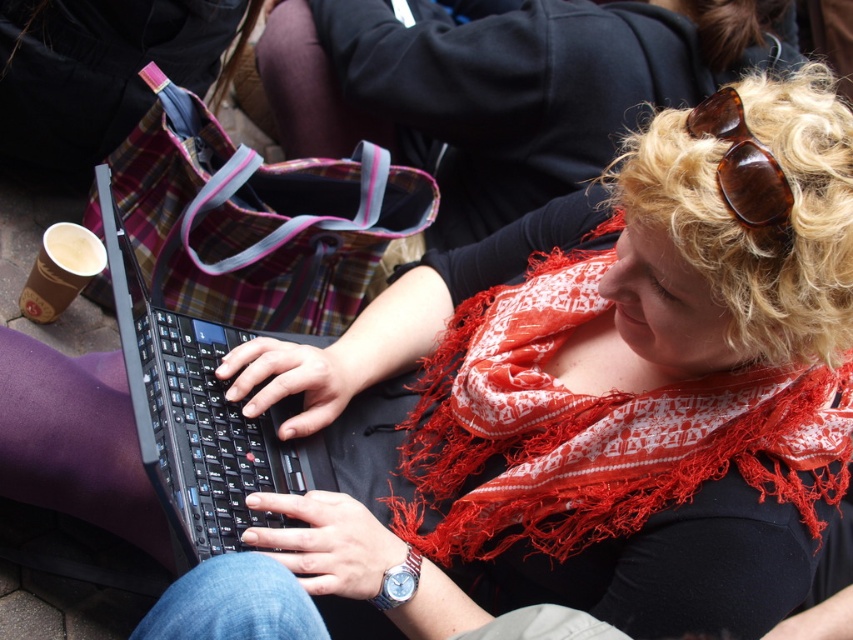
Question: Does red fringed scarf at center appear on the left side of tortoiseshell sunglasses at upper right?

Choices:
 (A) yes
 (B) no

Answer: (A)

Question: Among these points, which one is farthest from the camera?

Choices:
 (A) (706, 397)
 (B) (741, 164)

Answer: (A)

Question: Is black plastic laptop at center wider than tortoiseshell sunglasses at upper right?

Choices:
 (A) no
 (B) yes

Answer: (B)

Question: Which point is farther to the camera?

Choices:
 (A) black plastic laptop at center
 (B) red fringed scarf at center

Answer: (B)

Question: Which of the following is the closest to the observer?

Choices:
 (A) red fringed scarf at center
 (B) tortoiseshell sunglasses at upper right
 (C) black plastic laptop at center

Answer: (B)

Question: Does black plastic laptop at center appear under tortoiseshell sunglasses at upper right?

Choices:
 (A) no
 (B) yes

Answer: (B)